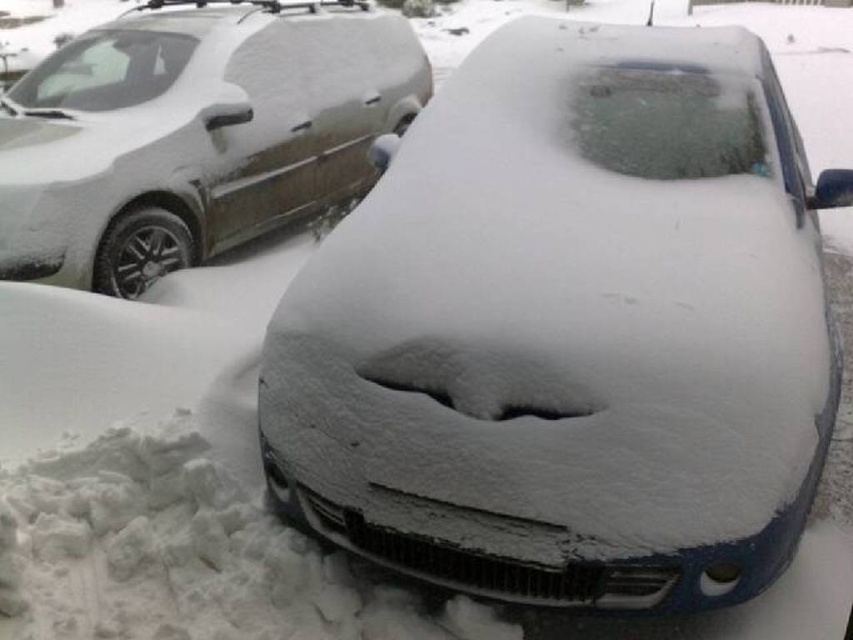
Question: Does snow-covered car at center have a larger size compared to sleek silver van at upper left?

Choices:
 (A) no
 (B) yes

Answer: (A)

Question: Among these points, which one is nearest to the camera?

Choices:
 (A) (115, 227)
 (B) (743, 579)

Answer: (B)

Question: Which of the following is the closest to the observer?

Choices:
 (A) sleek silver van at upper left
 (B) snow-covered car at center

Answer: (B)

Question: Does snow-covered car at center have a smaller size compared to sleek silver van at upper left?

Choices:
 (A) yes
 (B) no

Answer: (A)

Question: Is snow-covered car at center positioned at the back of sleek silver van at upper left?

Choices:
 (A) no
 (B) yes

Answer: (A)